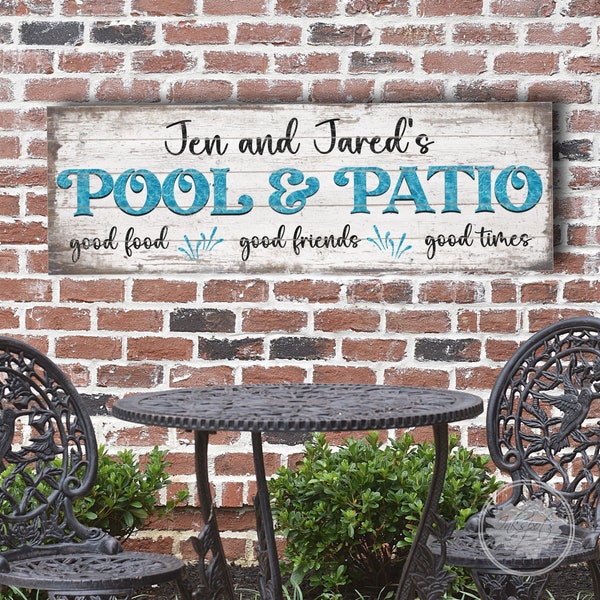
Where is `wall`? wall is located at coordinates (455, 54).